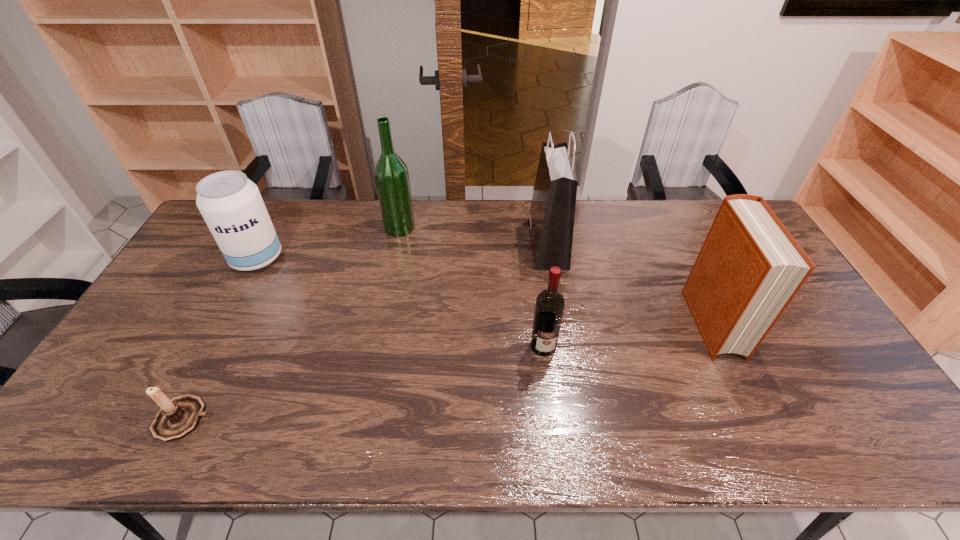
This screenshot has width=960, height=540. Identify the location of the farthest alcohol. (391, 175).

Locate an element on the screen. The image size is (960, 540). the second alcohol from left to right is located at coordinates (391, 175).

Image resolution: width=960 pixels, height=540 pixels. I want to click on shopping bag, so click(551, 218).

Where is `hardback book`? The height and width of the screenshot is (540, 960). hardback book is located at coordinates (750, 267).

You are a GUI agent. You are given a task and a screenshot of the screen. Output one action in this format:
    pyautogui.click(x=<x>, y=<y>)
    Task: Click on the leftmost alcohol
    The image size is (960, 540).
    Given the screenshot: What is the action you would take?
    pyautogui.click(x=231, y=205)

At what (x,y) coordinates should I click in order to perform the action: click on the nearest alcohol. Please return your answer as a coordinate pair (x, y). Image resolution: width=960 pixels, height=540 pixels. Looking at the image, I should click on (550, 303).

Where is `candle holder`? This screenshot has height=540, width=960. candle holder is located at coordinates (178, 417).

Image resolution: width=960 pixels, height=540 pixels. I want to click on the nearest object, so click(x=178, y=417).

Where is `vacant space located 0.050m on the front of the tallest alcohol`? The width and height of the screenshot is (960, 540). vacant space located 0.050m on the front of the tallest alcohol is located at coordinates (396, 247).

The image size is (960, 540). Find the location of `free spot located 0.100m on the front with handles of the shopping bag`. free spot located 0.100m on the front with handles of the shopping bag is located at coordinates (501, 244).